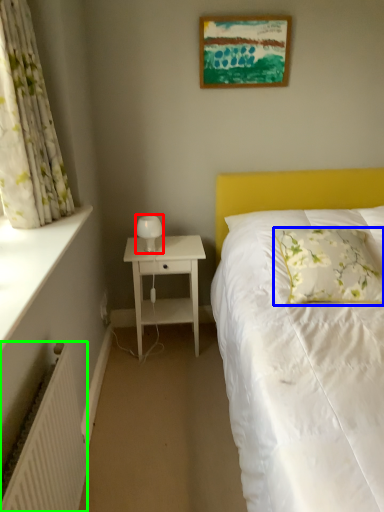
Question: Which object is the closest to the bedside lamp (highlighted by a red box)? Choose among these: pillow (highlighted by a blue box) or radiator (highlighted by a green box).

Choices:
 (A) pillow
 (B) radiator

Answer: (A)